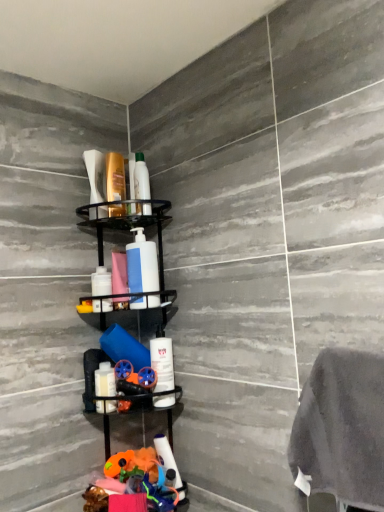
Question: Considering their positions, is black matte shelf at center located in front of or behind white matte pump bottle at center?

Choices:
 (A) behind
 (B) front

Answer: (B)

Question: Considering the positions of black matte shelf at center and white matte pump bottle at center in the image, is black matte shelf at center wider or thinner than white matte pump bottle at center?

Choices:
 (A) wide
 (B) thin

Answer: (A)

Question: Which is nearer to the white matte bottle at center, the second toiletry from the bottom?

Choices:
 (A) white matte bottle at center, the 3th toiletry viewed from the top
 (B) white glossy bottle at lower left, the 1th toiletry positioned from the bottom
 (C) black matte shelf at center
 (D) translucent plastic shampoo bottle at upper center, which is the 5th toiletry in bottom-to-top order
 (E) matte white soap dispenser at upper left, marked as the 2th toiletry in a top-to-bottom arrangement

Answer: (B)

Question: Which of these objects is positioned farthest from the white matte bottle at center, which ranks as the 3th toiletry in bottom-to-top order?

Choices:
 (A) translucent plastic shampoo bottle at upper center, which is the 5th toiletry in bottom-to-top order
 (B) white matte pump bottle at center
 (C) white glossy bottle at lower left, the 1th toiletry positioned from the bottom
 (D) matte white soap dispenser at upper left, positioned as the 4th toiletry in bottom-to-top order
 (E) black matte shelf at center

Answer: (A)